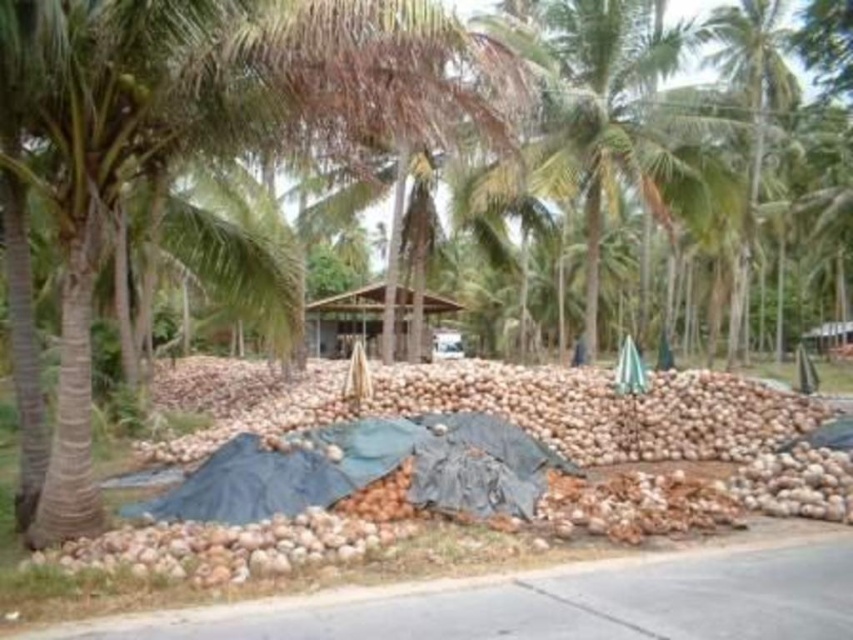
You are a delivery drone with a maximum flight range of 15 meters. You need to deliver a package from the green leafy palm tree at upper right to the brown wooden hut at center. Can you complete the delivery without needing to recharge?

The distance between the green leafy palm tree at upper right and the brown wooden hut at center is 14.54 meters, which is within your 15 meter flight range. Therefore, you can complete the delivery without needing to recharge.

You are standing in a tropical coconut processing area and need to reach the green leafy palm tree at center to collect some leaves. Considering your height is 5 feet 8 inches, can you safely walk to it without needing to climb?

The green leafy palm tree at center is 53.86 feet away from viewer. Since the distance is over 50 feet, you can safely walk to it without needing to climb as it is within a reasonable walking distance.